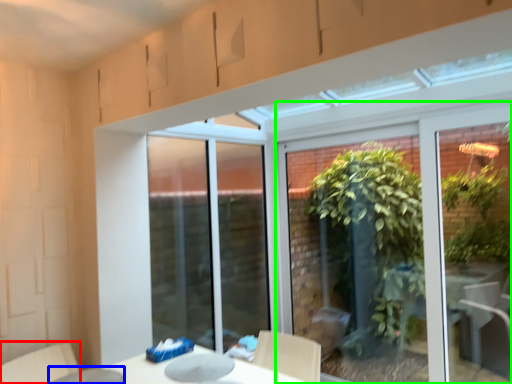
Question: Which object is the farthest from swivel chair (highlighted by a red box)? Choose among these: glass table (highlighted by a blue box) or window (highlighted by a green box).

Choices:
 (A) glass table
 (B) window

Answer: (B)